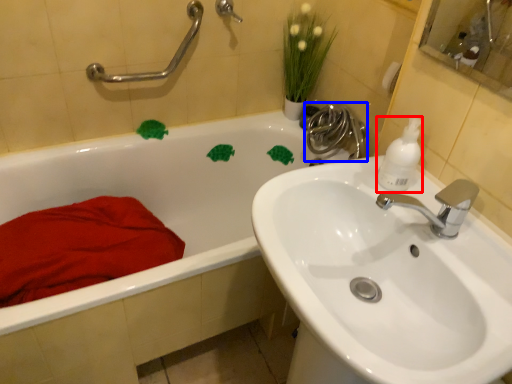
Question: Which object is closer to the camera taking this photo, cleaning product (highlighted by a red box) or plumbing fixture (highlighted by a blue box)?

Choices:
 (A) cleaning product
 (B) plumbing fixture

Answer: (A)